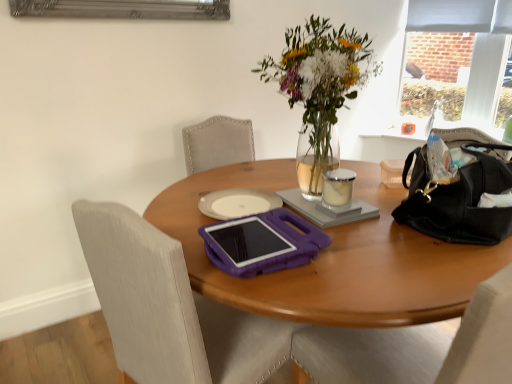
Question: From a real-world perspective, is purple plastic tablet at center positioned under black leather bag at right based on gravity?

Choices:
 (A) no
 (B) yes

Answer: (A)

Question: Does purple plastic tablet at center have a larger size compared to black leather bag at right?

Choices:
 (A) yes
 (B) no

Answer: (B)

Question: From the image's perspective, is purple plastic tablet at center located beneath black leather bag at right?

Choices:
 (A) no
 (B) yes

Answer: (A)

Question: Does purple plastic tablet at center have a lesser height compared to black leather bag at right?

Choices:
 (A) no
 (B) yes

Answer: (B)

Question: Would you say black leather bag at right is part of purple plastic tablet at center's contents?

Choices:
 (A) yes
 (B) no

Answer: (B)

Question: Is purple plastic tablet at center closer to the viewer compared to black leather bag at right?

Choices:
 (A) no
 (B) yes

Answer: (A)

Question: From a real-world perspective, is black leather handbag at right located higher than translucent glass vase at upper center?

Choices:
 (A) no
 (B) yes

Answer: (A)

Question: Is black leather handbag at right shorter than translucent glass vase at upper center?

Choices:
 (A) yes
 (B) no

Answer: (A)

Question: Does black leather handbag at right turn towards translucent glass vase at upper center?

Choices:
 (A) yes
 (B) no

Answer: (B)

Question: From the image's perspective, is black leather handbag at right on translucent glass vase at upper center?

Choices:
 (A) yes
 (B) no

Answer: (B)

Question: Is black leather handbag at right to the right of translucent glass vase at upper center from the viewer's perspective?

Choices:
 (A) yes
 (B) no

Answer: (A)

Question: Considering the relative sizes of black leather handbag at right and translucent glass vase at upper center in the image provided, is black leather handbag at right wider than translucent glass vase at upper center?

Choices:
 (A) no
 (B) yes

Answer: (A)

Question: Is gray matte notebook at center taller than purple plastic chair at center?

Choices:
 (A) no
 (B) yes

Answer: (A)